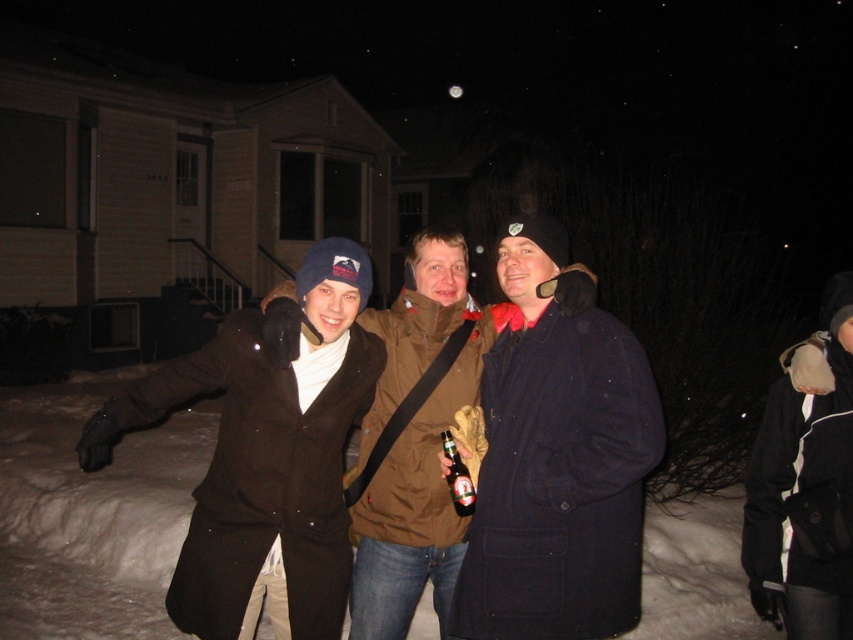
Question: Is the position of matte brown coat at center more distant than that of translucent glass bottle at center?

Choices:
 (A) yes
 (B) no

Answer: (B)

Question: Which point is farther to the camera?

Choices:
 (A) (434, 502)
 (B) (218, 500)

Answer: (A)

Question: Is black fuzzy hat at upper right closer to camera compared to translucent glass bottle at center?

Choices:
 (A) no
 (B) yes

Answer: (B)

Question: Can you confirm if matte brown coat at center is smaller than translucent glass bottle at center?

Choices:
 (A) no
 (B) yes

Answer: (A)

Question: Which object appears closest to the camera in this image?

Choices:
 (A) translucent glass bottle at center
 (B) matte brown coat at center

Answer: (B)

Question: Which object is positioned farthest from the black fuzzy hat at upper right?

Choices:
 (A) brown woolen coat at center
 (B) matte brown coat at center
 (C) translucent glass bottle at center

Answer: (B)